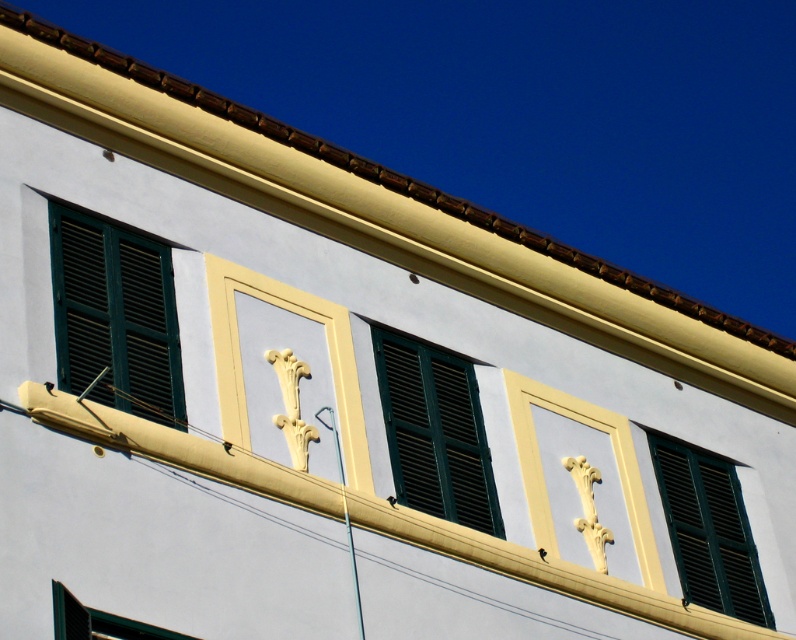
Question: Which object is farther from the camera taking this photo?

Choices:
 (A) green matte shutters at center
 (B) green matte shutters at right

Answer: (B)

Question: Which point is farther to the camera?

Choices:
 (A) green matte shutters at center
 (B) green matte shutters at right
 (C) green matte shutters at left

Answer: (B)

Question: Does green matte shutters at center have a larger size compared to green matte shutters at right?

Choices:
 (A) yes
 (B) no

Answer: (B)

Question: Which object is the farthest from the green matte shutters at left?

Choices:
 (A) green matte shutters at center
 (B) green matte shutters at right

Answer: (B)

Question: Is green matte shutters at left smaller than green matte shutters at center?

Choices:
 (A) no
 (B) yes

Answer: (B)

Question: Can you confirm if green matte shutters at center is positioned above green matte shutters at right?

Choices:
 (A) yes
 (B) no

Answer: (A)